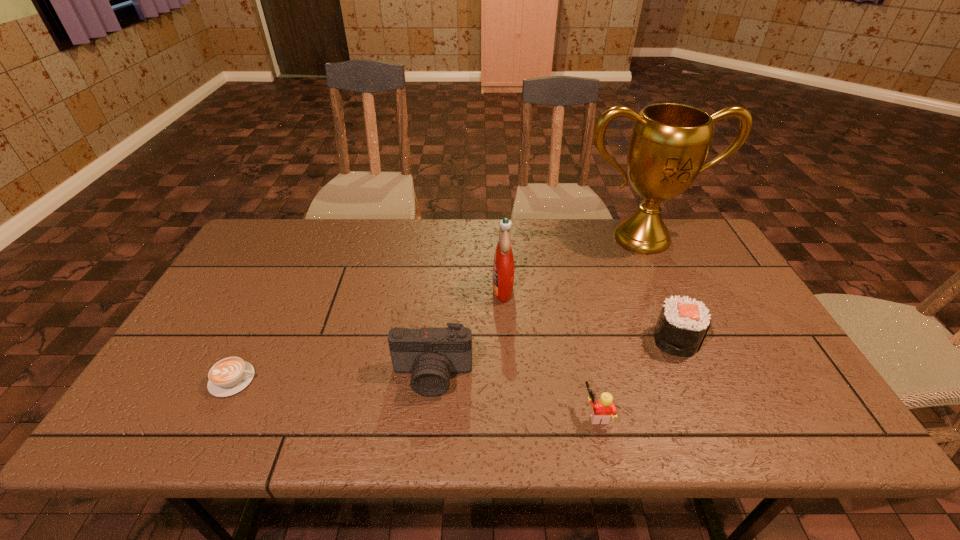
Locate an element on the screen. This screenshot has width=960, height=540. vacant space that satisfies the following two spatial constraints: 1. on the surface of the tallest object with symbols; 2. on the front surface of the second tallest object is located at coordinates [665, 288].

This screenshot has height=540, width=960. Identify the location of free space that satisfies the following two spatial constraints: 1. on the surface of the farthest object with symbols; 2. on the front surface of the fifth nearest object. (665, 288).

Where is `free location that satisfies the following two spatial constraints: 1. at the lens of the camera; 2. on the side of the leftmost object with the handle`? free location that satisfies the following two spatial constraints: 1. at the lens of the camera; 2. on the side of the leftmost object with the handle is located at coordinates (432, 380).

You are a GUI agent. You are given a task and a screenshot of the screen. Output one action in this format:
    pyautogui.click(x=<x>, y=<y>)
    Task: Click on the vacant point that satisfies the following two spatial constraints: 1. on the surface of the farthest object with symbols; 2. on the side of the leftmost object with the handle
    This screenshot has width=960, height=540.
    Given the screenshot: What is the action you would take?
    pyautogui.click(x=708, y=380)

Locate an element on the screen. This screenshot has width=960, height=540. vacant point that satisfies the following two spatial constraints: 1. on the front surface of the detergent; 2. at the lens of the second object from left to right is located at coordinates (508, 376).